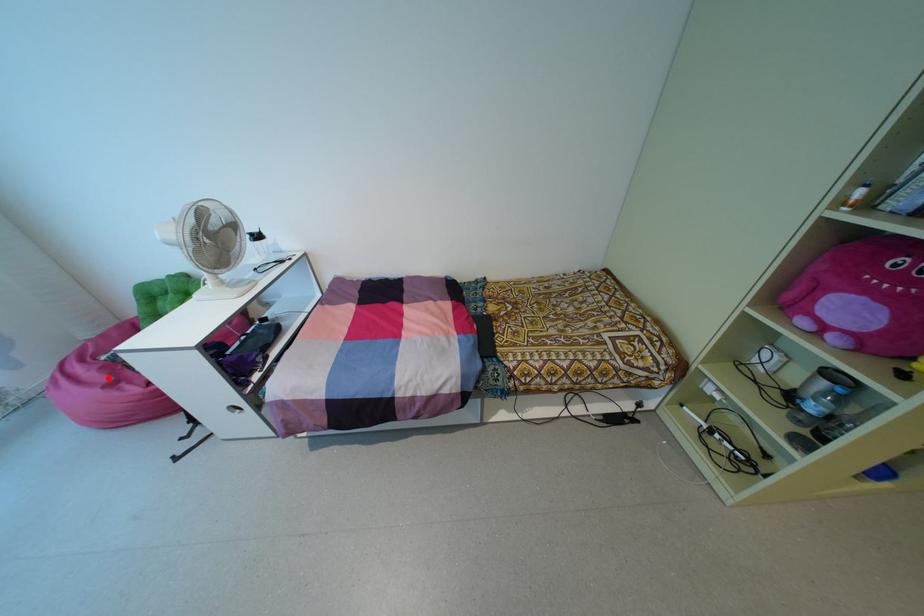
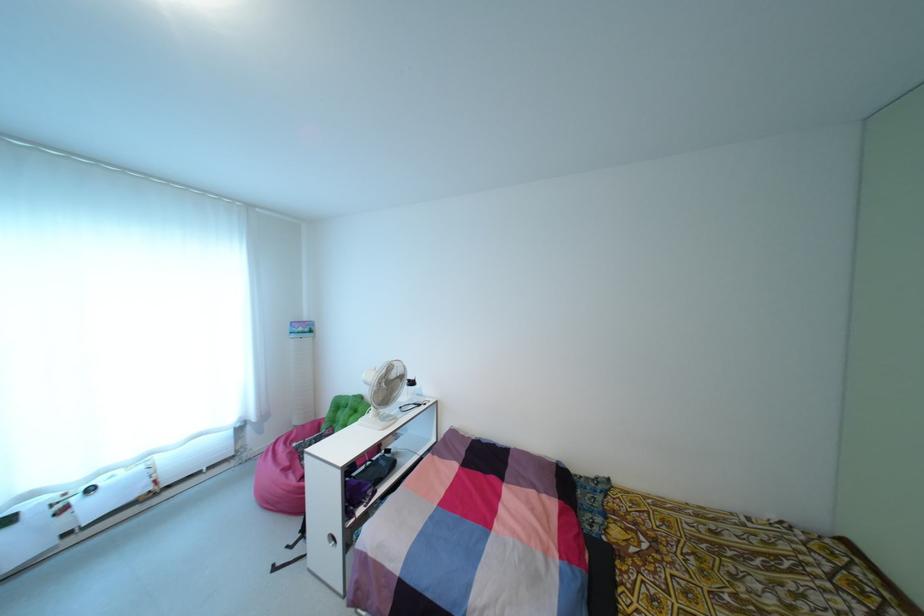
Where in the second image is the point corresponding to the highlighted location from the first image?

(286, 463)